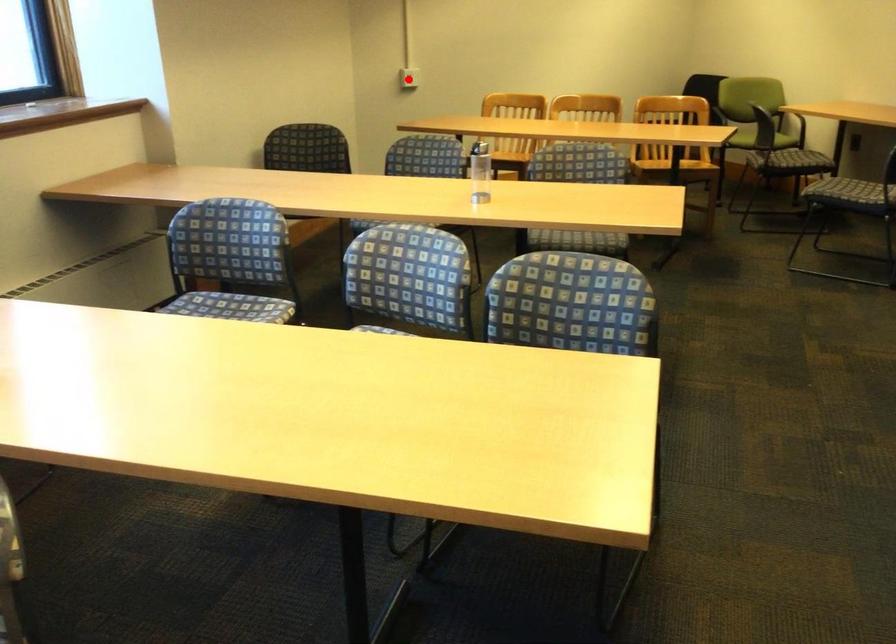
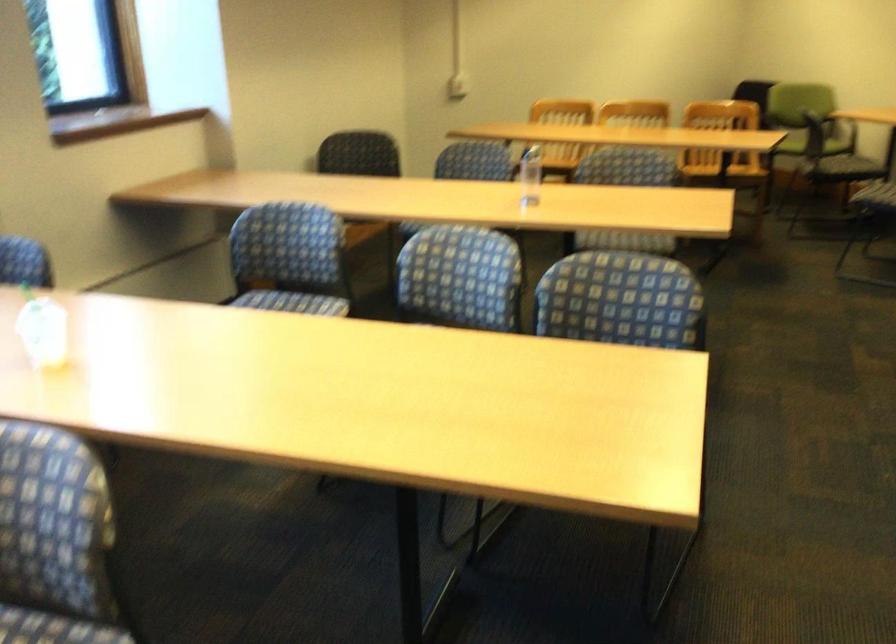
In the second image, find the point that corresponds to the highlighted location in the first image.

(458, 86)